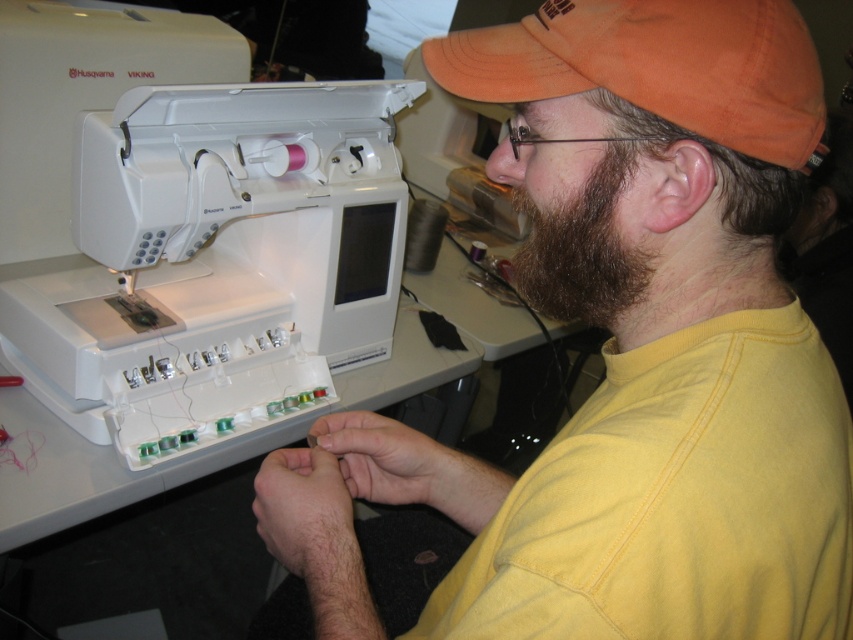
Can you confirm if white plastic sewing machine at left is positioned to the right of orange fabric cap at upper right?

In fact, white plastic sewing machine at left is to the left of orange fabric cap at upper right.

Does point (222, 429) come closer to viewer compared to point (677, 22)?

No, it is behind (677, 22).

Locate an element on the screen. white plastic sewing machine at left is located at coordinates (218, 260).

This screenshot has width=853, height=640. I want to click on white plastic sewing machine at left, so click(218, 260).

Consider the image. Who is more distant from viewer, (535, 154) or (196, 214)?

The point (196, 214) is more distant.

Is yellow cotton shirt at center thinner than white plastic sewing machine at left?

Yes.

Between point (579, 134) and point (335, 170), which one is positioned in front?

Point (579, 134) is in front.

The height and width of the screenshot is (640, 853). In order to click on yellow cotton shirt at center in this screenshot , I will do `click(614, 362)`.

Which of these two, yellow cotton shirt at center or orange fabric cap at upper right, stands taller?

With more height is yellow cotton shirt at center.

At what (x,y) coordinates should I click in order to perform the action: click on yellow cotton shirt at center. Please return your answer as a coordinate pair (x, y). Looking at the image, I should click on (614, 362).

You are a GUI agent. You are given a task and a screenshot of the screen. Output one action in this format:
    pyautogui.click(x=<x>, y=<y>)
    Task: Click on the yellow cotton shirt at center
    The image size is (853, 640).
    Given the screenshot: What is the action you would take?
    pyautogui.click(x=614, y=362)